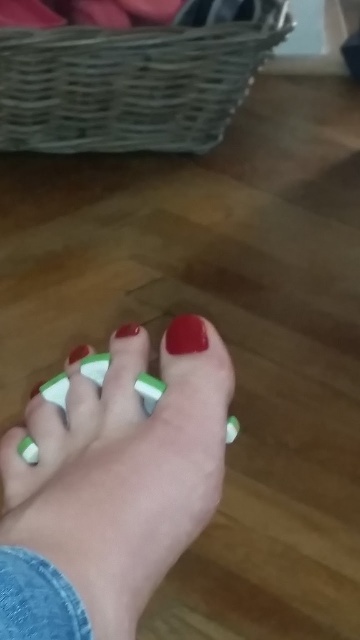
You are standing in a room and see the woven wicker basket at upper left. Can you estimate its position using coordinates?

The woven wicker basket at upper left is located at point (135, 77).

Consider the image. You are a delivery robot in a home setting. You need to place a small package on the floor near the woven wicker basket at upper left without blocking the green matte nail at lower left. Can you fit the package between them if the package is 10 inches wide?

The distance between the woven wicker basket at upper left and the green matte nail at lower left is 25.69 inches. Since the package is only 10 inches wide, there is enough space to place it near the woven wicker basket at upper left while keeping it away from the green matte nail at lower left.

You are a nail technician assessing a client who has their glossy red nail at center and green matte nail at lower left. Which nail is positioned to the right of the other?

The glossy red nail at center is positioned on the right side of green matte nail at lower left.